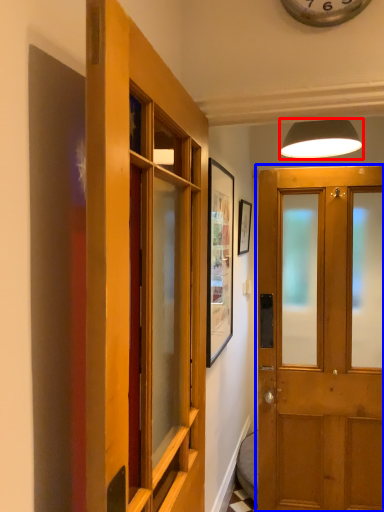
Question: Which object is closer to the camera taking this photo, lamp (highlighted by a red box) or door (highlighted by a blue box)?

Choices:
 (A) lamp
 (B) door

Answer: (B)